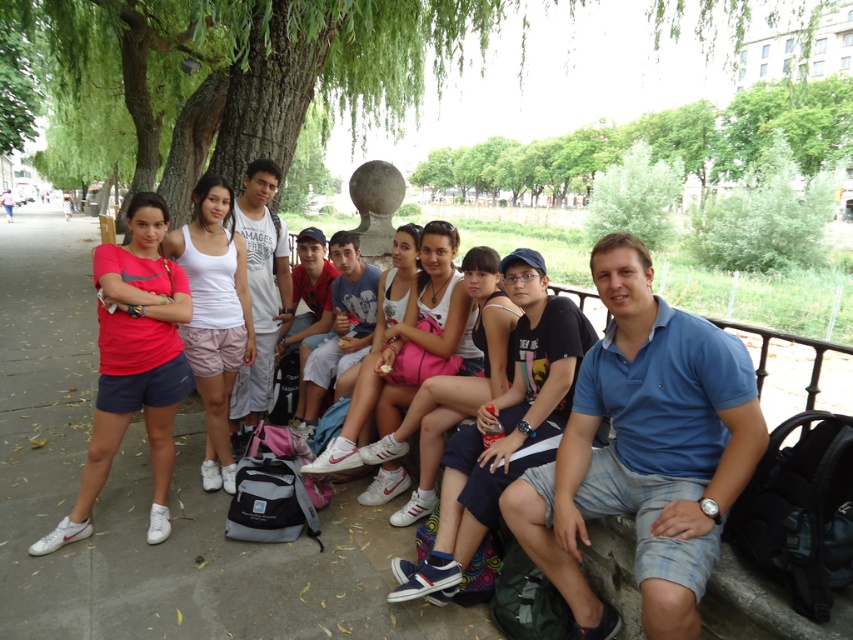
Is dark blue denim shorts at center in front of white cotton shirt at center?

That is True.

Does dark blue denim shorts at center have a greater height compared to white cotton shirt at center?

Yes, dark blue denim shorts at center is taller than white cotton shirt at center.

Who is more forward, (544, 444) or (310, 433)?

Point (544, 444) is in front.

Locate an element on the screen. The height and width of the screenshot is (640, 853). dark blue denim shorts at center is located at coordinates (503, 428).

Who is positioned more to the left, blue cotton polo shirt at center or dark blue denim shorts at center?

dark blue denim shorts at center

Who is more forward, [578,573] or [550,365]?

Positioned in front is point [578,573].

The width and height of the screenshot is (853, 640). Find the location of `blue cotton polo shirt at center`. blue cotton polo shirt at center is located at coordinates (643, 451).

Does white fabric tank top at center have a greater height compared to white cotton shirt at center?

Yes.

Can you confirm if white fabric tank top at center is wider than white cotton shirt at center?

Yes, white fabric tank top at center is wider than white cotton shirt at center.

Between point (486, 330) and point (373, 323), which one is positioned in front?

Positioned in front is point (486, 330).

Locate an element on the screen. The width and height of the screenshot is (853, 640). white fabric tank top at center is located at coordinates (454, 385).